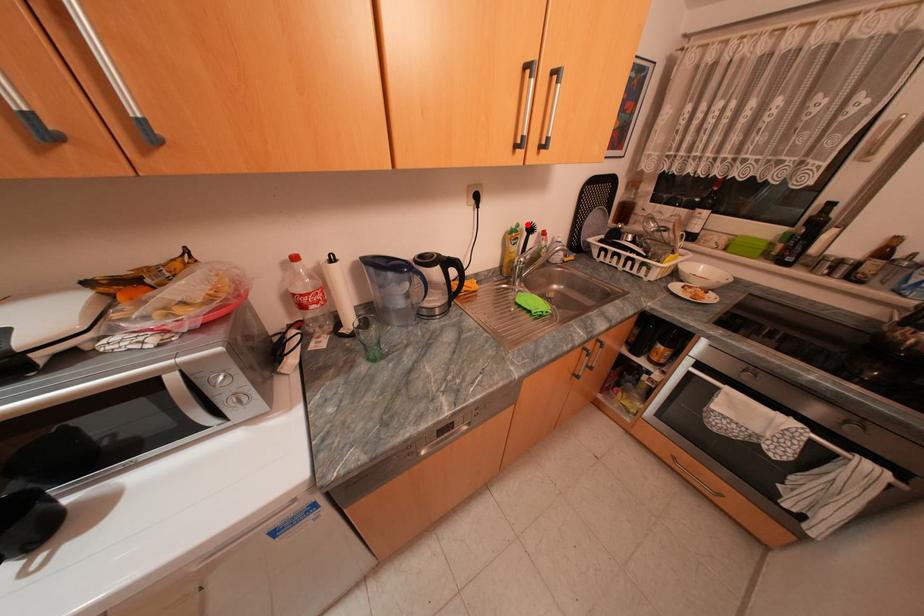
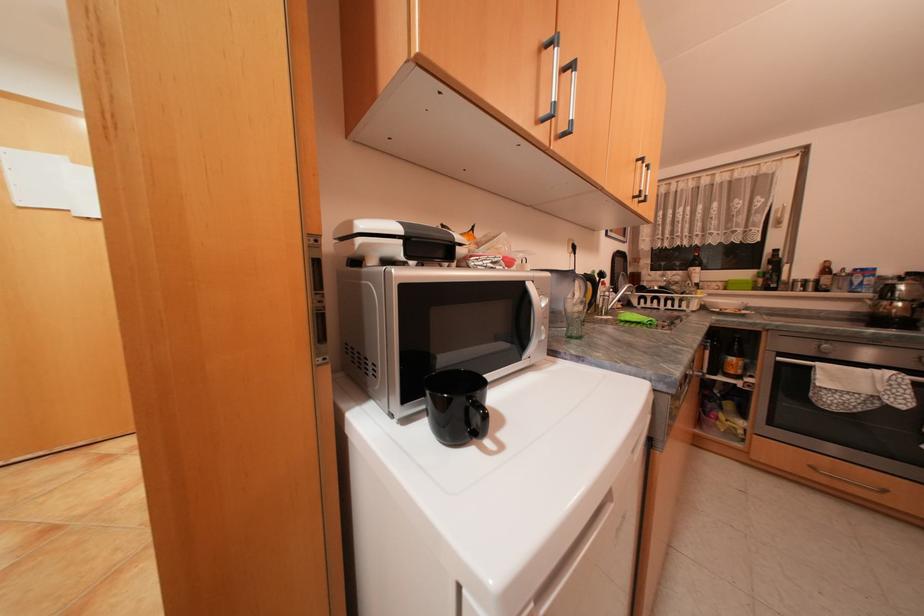
Find the pixel in the second image that matches the highlighted location in the first image.

(602, 270)